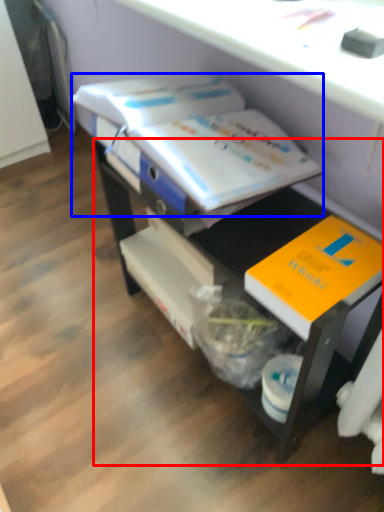
Question: Among these objects, which one is farthest to the camera, desk (highlighted by a red box) or book (highlighted by a blue box)?

Choices:
 (A) desk
 (B) book

Answer: (B)